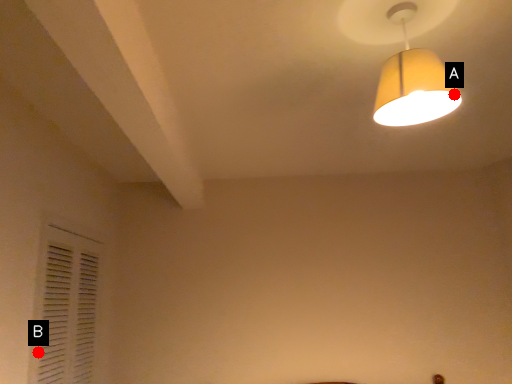
Question: Two points are circled on the image, labeled by A and B beside each circle. Among these points, which one is farthest from the camera?

Choices:
 (A) A is further
 (B) B is further

Answer: (B)